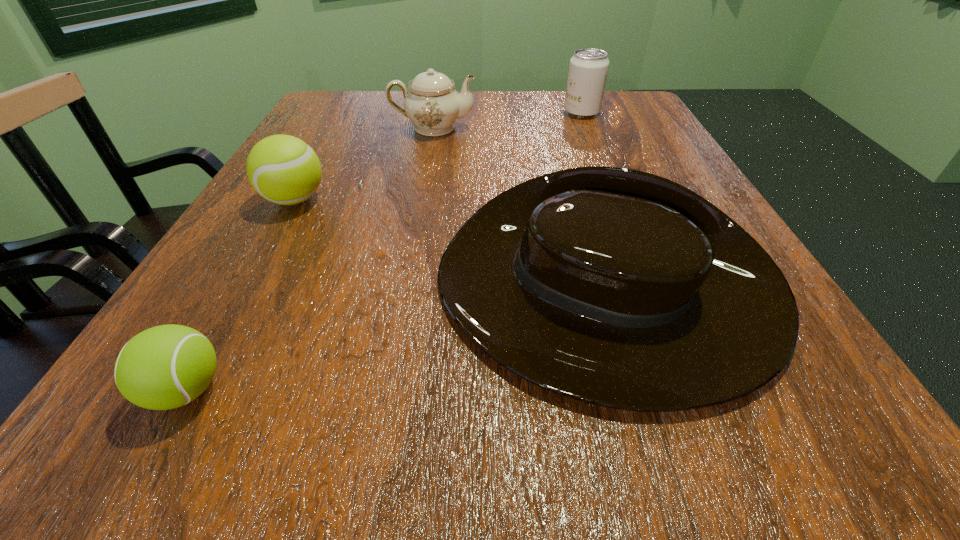
This screenshot has height=540, width=960. Identify the location of unoccupied position between the taller tennis ball and the chinaware. (364, 164).

The width and height of the screenshot is (960, 540). I want to click on vacant space in between the taller tennis ball and the chinaware, so pos(364,164).

The height and width of the screenshot is (540, 960). Identify the location of empty location between the taller tennis ball and the shortest object. (241, 295).

The image size is (960, 540). I want to click on vacant area that lies between the shortest object and the soda can, so click(x=384, y=251).

Locate an element on the screen. The height and width of the screenshot is (540, 960). blank region between the chinaware and the taller tennis ball is located at coordinates (364, 164).

Locate an element on the screen. The image size is (960, 540). vacant region between the chinaware and the farther tennis ball is located at coordinates (364, 164).

You are a GUI agent. You are given a task and a screenshot of the screen. Output one action in this format:
    pyautogui.click(x=<x>, y=<y>)
    Task: Click on the object that can be found as the fourth closest to the shortest object
    
    Given the screenshot: What is the action you would take?
    pyautogui.click(x=588, y=68)

Locate which object is the third closest to the soda can. Please provide its 2D coordinates. Your answer should be formatted as a tuple, i.e. [(x, y)], where the tuple contains the x and y coordinates of a point satisfying the conditions above.

[(283, 169)]

Where is `blank space that satisfies the following two spatial constraints: 1. on the back side of the soda can; 2. on the left side of the farther tennis ball`? Image resolution: width=960 pixels, height=540 pixels. blank space that satisfies the following two spatial constraints: 1. on the back side of the soda can; 2. on the left side of the farther tennis ball is located at coordinates pos(343,112).

Identify the location of vacant space that satisfies the following two spatial constraints: 1. at the spout of the cowboy hat; 2. on the right side of the chinaware. (402, 295).